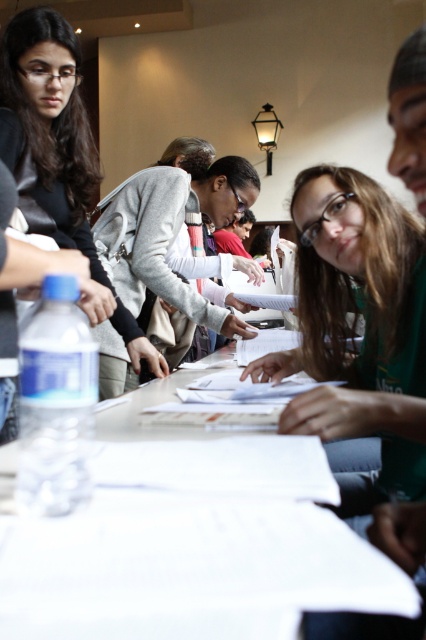
Question: Is white paper at center thinner than matte black jacket at upper left?

Choices:
 (A) yes
 (B) no

Answer: (A)

Question: Among these objects, which one is nearest to the camera?

Choices:
 (A) light gray sweater at center
 (B) matte black jacket at upper left
 (C) white paper at center

Answer: (C)

Question: Does white paper at center appear over light gray sweater at center?

Choices:
 (A) no
 (B) yes

Answer: (A)

Question: Where is matte black jacket at upper left located in relation to light gray sweater at center in the image?

Choices:
 (A) left
 (B) right

Answer: (A)

Question: Which of these objects is positioned closest to the matte black jacket at upper left?

Choices:
 (A) white paper at center
 (B) light gray sweater at center

Answer: (B)

Question: Which of the following is the closest to the observer?

Choices:
 (A) (72, 38)
 (B) (201, 173)

Answer: (A)